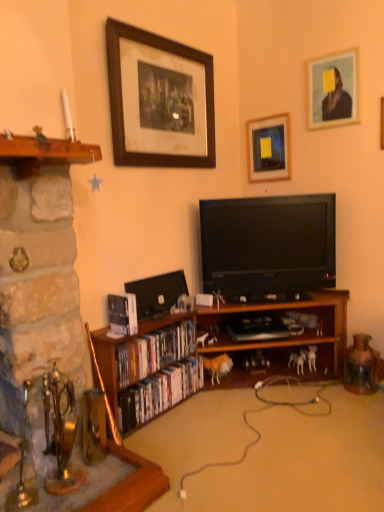
Locate an element on the screen. free point in front of brown fur figurine at lower center, the 1th animal positioned from the left is located at coordinates (215, 401).